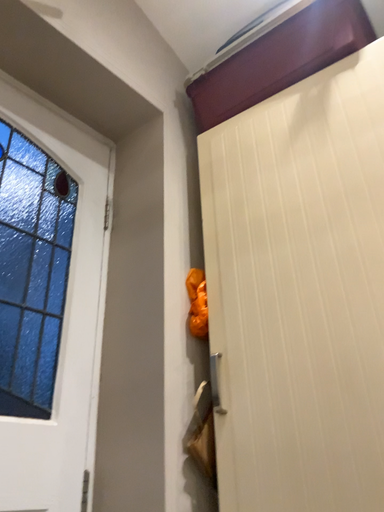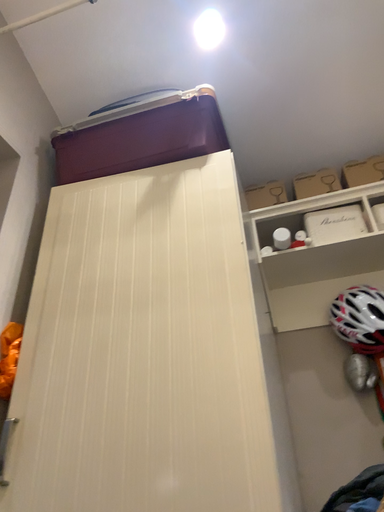
Question: How did the camera likely rotate when shooting the video?

Choices:
 (A) rotated right
 (B) rotated left

Answer: (A)